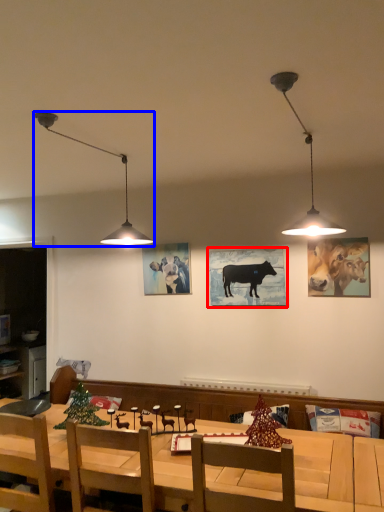
Question: Which object appears farthest to the camera in this image, picture frame (highlighted by a red box) or lamp (highlighted by a blue box)?

Choices:
 (A) picture frame
 (B) lamp

Answer: (A)